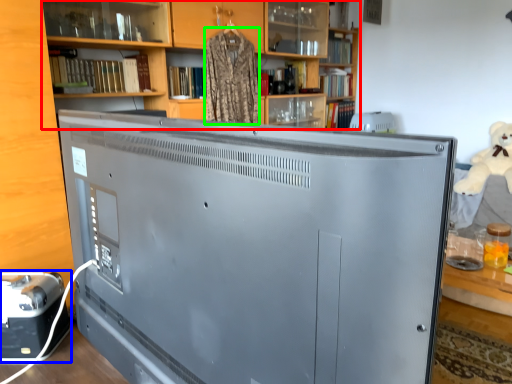
Question: Based on their relative distances, which object is farther from bookcase (highlighted by a red box)? Choose from appliance (highlighted by a blue box) and clothing (highlighted by a green box).

Choices:
 (A) appliance
 (B) clothing

Answer: (A)